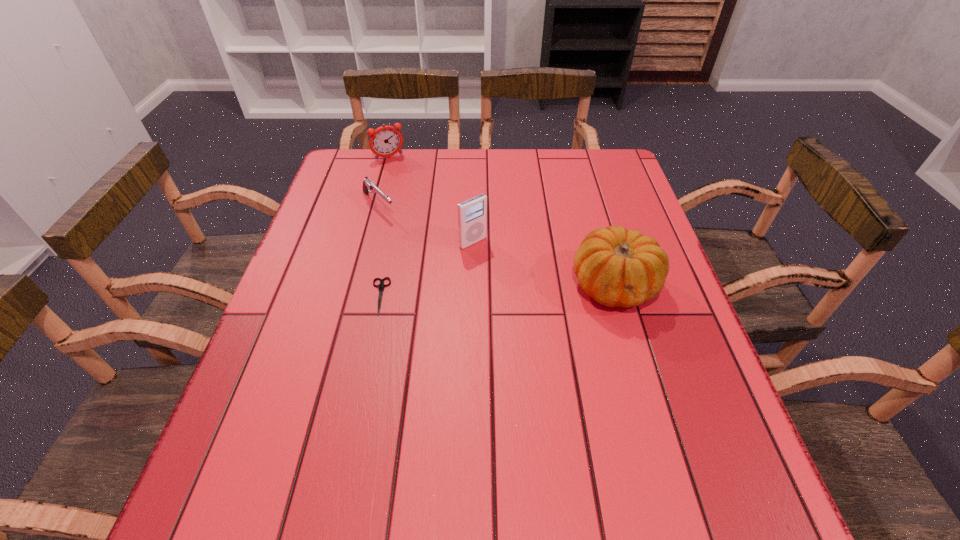
Locate an element on the screen. free space on the desktop that is between the shortest object and the gourd and is positioned on the front-facing side of the second farthest object is located at coordinates (468, 292).

Locate an element on the screen. The width and height of the screenshot is (960, 540). vacant space on the desktop that is between the shears and the gourd and is positioned on the front-facing side of the fourth object from left to right is located at coordinates (525, 289).

Where is `vacant space on the desktop that is between the shears and the gourd and is positioned on the front-facing side of the alarm clock`? vacant space on the desktop that is between the shears and the gourd and is positioned on the front-facing side of the alarm clock is located at coordinates (471, 292).